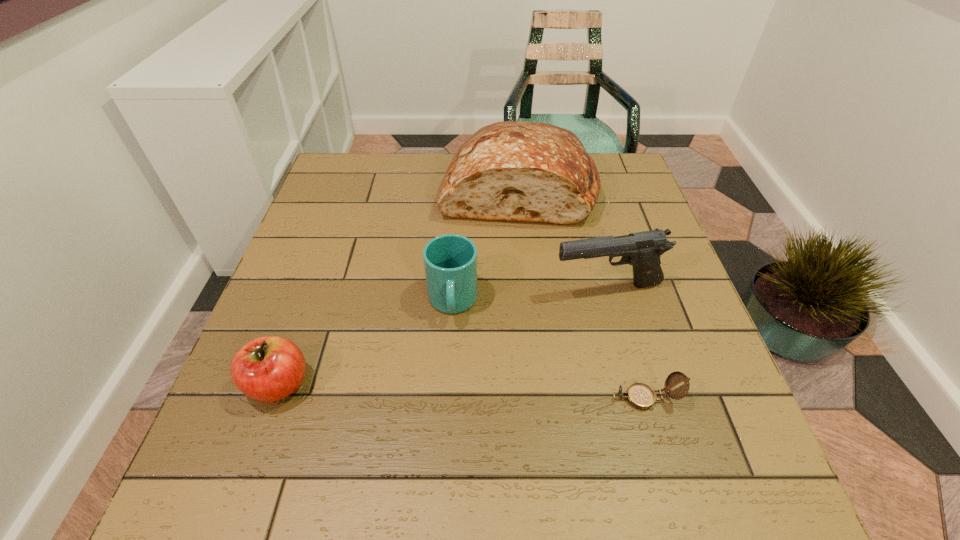
The width and height of the screenshot is (960, 540). I want to click on free space at the near edge of the desktop, so click(x=448, y=441).

Locate an element on the screen. vacant space at the left edge of the desktop is located at coordinates (365, 202).

Where is `free spot at the right edge of the desktop`? The image size is (960, 540). free spot at the right edge of the desktop is located at coordinates (706, 348).

Identify the location of free spot at the far left corner of the desktop. 329,184.

You are a GUI agent. You are given a task and a screenshot of the screen. Output one action in this format:
    pyautogui.click(x=<x>, y=<y>)
    Task: Click on the vacant region at the near left corner of the desktop
    
    Given the screenshot: What is the action you would take?
    pyautogui.click(x=239, y=409)

In the image, there is a desktop. What are the coordinates of `blank space at the far right corner` in the screenshot? It's located at (605, 172).

What are the coordinates of `free area in between the second shortest object and the gun` in the screenshot? It's located at (444, 337).

The height and width of the screenshot is (540, 960). Identify the location of free area in between the bread and the compass. (582, 293).

I want to click on vacant space that is in between the cup and the compass, so click(549, 350).

Find the location of `empty space between the tallest object and the cup`. empty space between the tallest object and the cup is located at coordinates (485, 245).